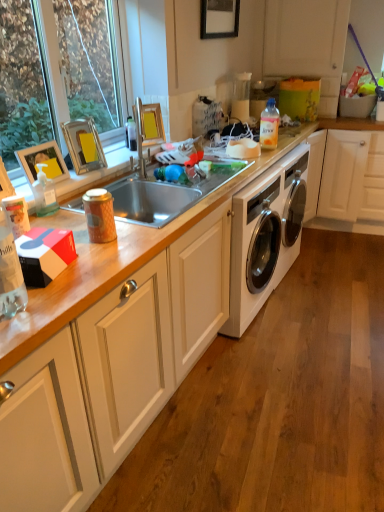
Where is `vacant point to the right of white glossy washing machine at center`? Image resolution: width=384 pixels, height=512 pixels. vacant point to the right of white glossy washing machine at center is located at coordinates (336, 260).